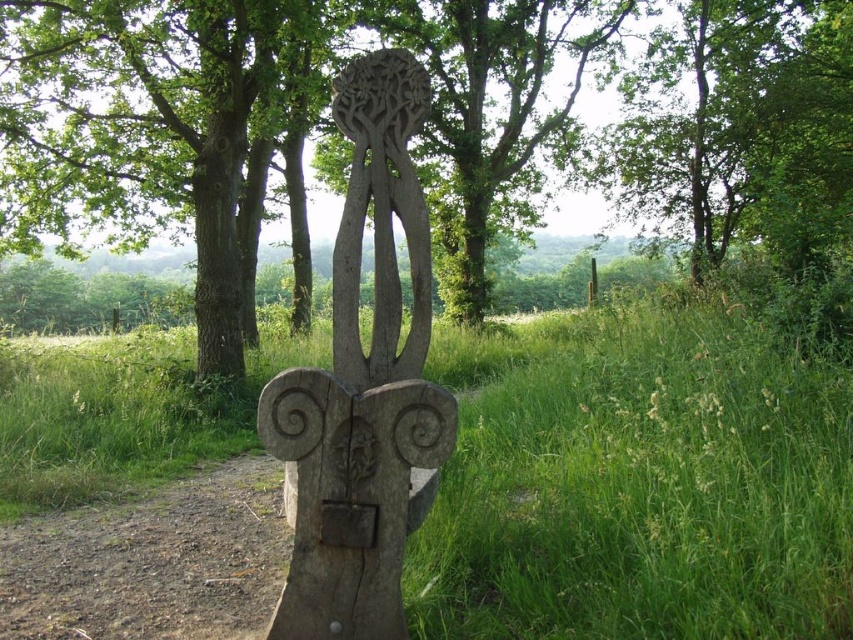
Can you confirm if green grass at center is thinner than wooden carving at center?

No.

Who is higher up, green grass at center or wooden carving at center?

wooden carving at center is above.

Between point (457, 336) and point (381, 609), which one is positioned in front?

Positioned in front is point (381, 609).

This screenshot has height=640, width=853. In order to click on green grass at center in this screenshot , I will do `click(637, 483)`.

How much distance is there between natural wood carving at center and smooth brown tree trunk at center?

natural wood carving at center and smooth brown tree trunk at center are 1.23 meters apart from each other.

The height and width of the screenshot is (640, 853). What are the coordinates of `natural wood carving at center` in the screenshot? It's located at 228,100.

Does point (593, 168) come closer to viewer compared to point (218, 161)?

No, it is behind (218, 161).

At what (x,y) coordinates should I click in order to perform the action: click on natural wood carving at center. Please return your answer as a coordinate pair (x, y). Image resolution: width=853 pixels, height=640 pixels. Looking at the image, I should click on 228,100.

Does smooth brown tree trunk at center appear over wooden carving at center?

Yes, smooth brown tree trunk at center is above wooden carving at center.

Who is lower down, smooth brown tree trunk at center or wooden carving at center?

wooden carving at center

Which is behind, point (97, 32) or point (428, 298)?

Positioned behind is point (97, 32).

Identify the location of smooth brown tree trunk at center. (170, 131).